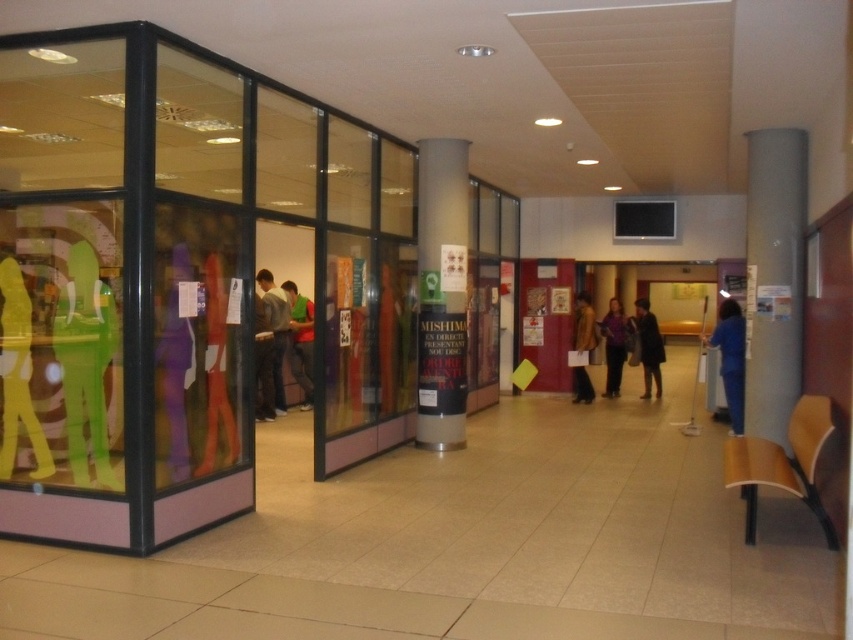
Can you confirm if gray matte pillar at right is shorter than dark brown leather coat at center?

Incorrect, gray matte pillar at right's height does not fall short of dark brown leather coat at center's.

Which is behind, point (805, 154) or point (659, 358)?

The point (659, 358) is behind.

Where is `gray matte pillar at right`? The height and width of the screenshot is (640, 853). gray matte pillar at right is located at coordinates (773, 278).

What do you see at coordinates (300, 340) in the screenshot?
I see `green matte shirt at center` at bounding box center [300, 340].

Consider the image. Can you confirm if green matte shirt at center is wider than dark brown leather coat at center?

Yes, green matte shirt at center is wider than dark brown leather coat at center.

Does point (310, 404) come in front of point (641, 308)?

Yes, it is in front of point (641, 308).

At what (x,y) coordinates should I click in order to perform the action: click on green matte shirt at center. Please return your answer as a coordinate pair (x, y). The width and height of the screenshot is (853, 640). Looking at the image, I should click on (300, 340).

Is metallic silver pillar at center positioned behind purple matte dress at center?

No, it is in front of purple matte dress at center.

Is point (448, 332) farther from camera compared to point (614, 310)?

That is False.

Which is in front, point (426, 179) or point (624, 336)?

Point (426, 179) is in front.

The image size is (853, 640). What are the coordinates of `metallic silver pillar at center` in the screenshot? It's located at (440, 292).